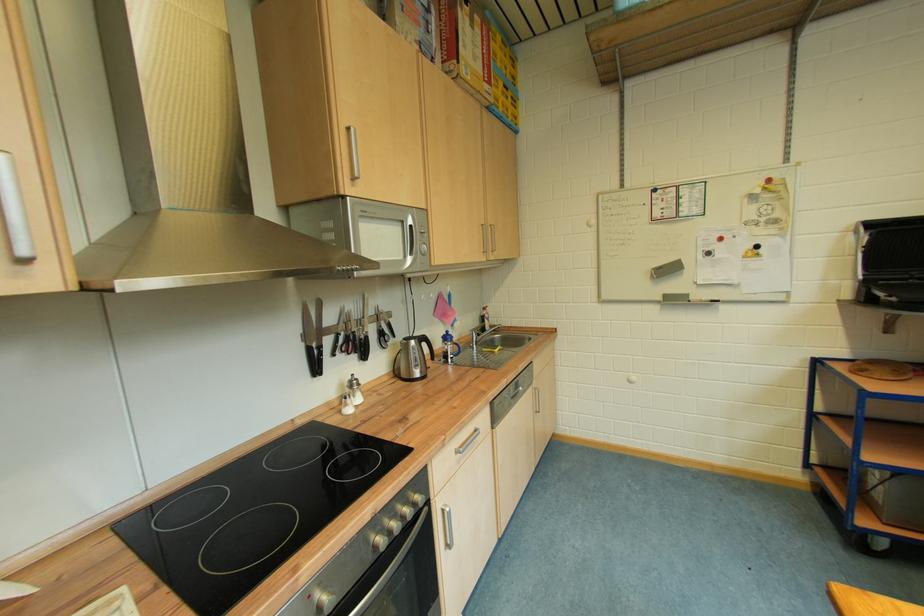
Where would you pull the silver drawer handle? Please return your answer as a coordinate pair (x, y).

(467, 440)